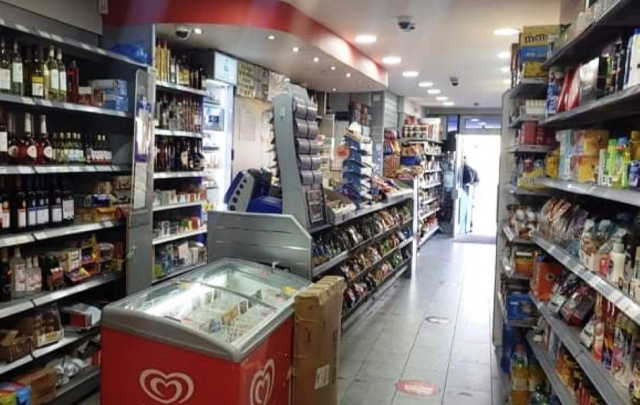
You are a GUI agent. You are given a task and a screenshot of the screen. Output one action in this format:
    pyautogui.click(x=<x>, y=<y>)
    Task: Click on the front door
    
    Given the screenshot: What is the action you would take?
    pyautogui.click(x=483, y=204)